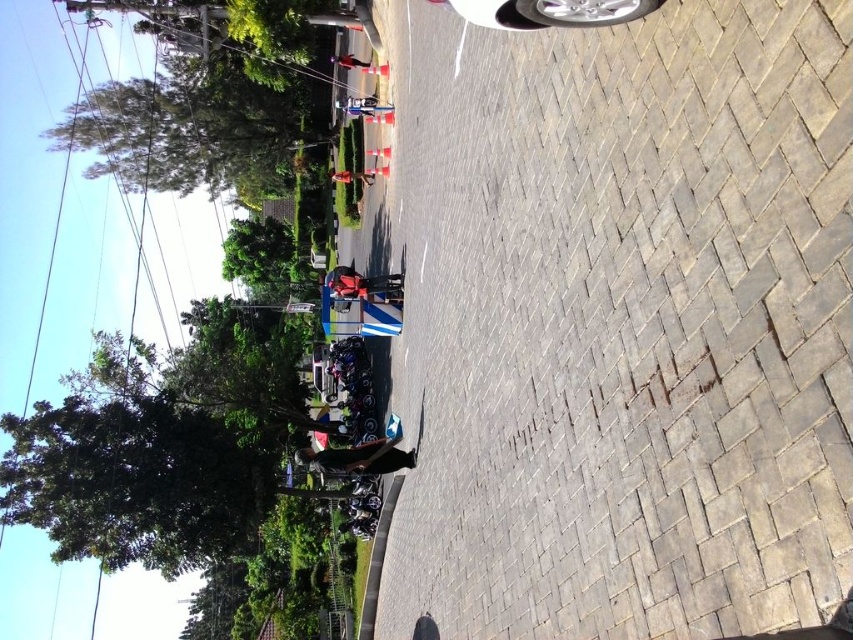
Which is more to the right, dark brown leather jacket at lower center or matte black jacket at center?

dark brown leather jacket at lower center is more to the right.

Measure the distance between point (312, 451) and camera.

They are 84.21 feet apart.

Does point (381, 444) lie behind point (363, 173)?

No, (381, 444) is closer to viewer.

At what (x,y) coordinates should I click in order to perform the action: click on dark brown leather jacket at lower center. Please return your answer as a coordinate pair (x, y). Looking at the image, I should click on (358, 458).

Between silver metallic car at upper center and matte black helmet at center, which one has more height?

matte black helmet at center is taller.

Which is above, silver metallic car at upper center or matte black helmet at center?

silver metallic car at upper center

The width and height of the screenshot is (853, 640). What do you see at coordinates (549, 12) in the screenshot? I see `silver metallic car at upper center` at bounding box center [549, 12].

At what (x,y) coordinates should I click in order to perform the action: click on silver metallic car at upper center. Please return your answer as a coordinate pair (x, y). The height and width of the screenshot is (640, 853). Looking at the image, I should click on (549, 12).

How distant is matte black jacket at center from shiny red jacket at center?

matte black jacket at center and shiny red jacket at center are 4.08 meters apart from each other.

Who is more forward, (363, 172) or (352, 60)?

Positioned in front is point (363, 172).

Where is `matte black jacket at center`? Image resolution: width=853 pixels, height=640 pixels. matte black jacket at center is located at coordinates (351, 177).